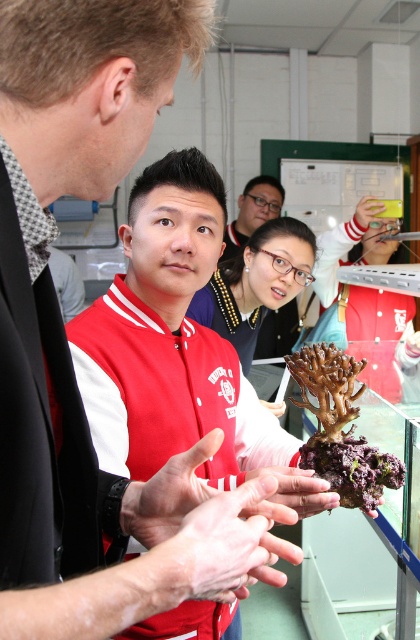
Question: Considering the real-world distances, which object is farthest from the matte white hand at center?

Choices:
 (A) matte brown coral at center
 (B) smooth skin hand at center
 (C) matte black hand at center

Answer: (B)

Question: Estimate the real-world distances between objects in this image. Which object is farther from the matte red jacket at center?

Choices:
 (A) matte white hand at center
 (B) matte yellow hand at center

Answer: (B)

Question: Is matte red jacket at center bigger than matte brown coral at center?

Choices:
 (A) no
 (B) yes

Answer: (B)

Question: From the image, what is the correct spatial relationship of smooth skin hand at center in relation to matte black hand at center?

Choices:
 (A) below
 (B) above

Answer: (B)

Question: Which object is closer to the camera taking this photo?

Choices:
 (A) smooth skin hand at center
 (B) matte black hand at center
 (C) matte yellow hand at center
 (D) matte brown coral at center

Answer: (A)

Question: Considering the relative positions of matte yellow hand at center and matte white hand at center in the image provided, where is matte yellow hand at center located with respect to matte white hand at center?

Choices:
 (A) above
 (B) below

Answer: (A)